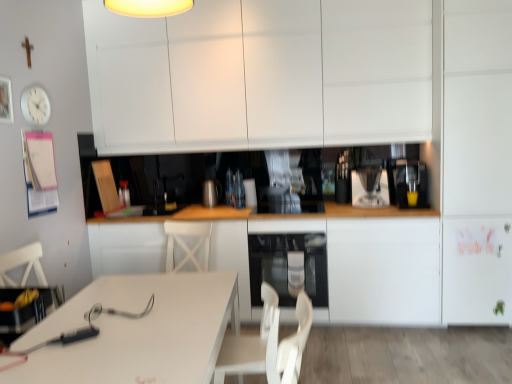
Question: Is satin black oven at lower center positioned in front of white glossy table at lower left?

Choices:
 (A) no
 (B) yes

Answer: (A)

Question: Is satin black oven at lower center to the right of white glossy table at lower left from the viewer's perspective?

Choices:
 (A) no
 (B) yes

Answer: (B)

Question: Can you confirm if satin black oven at lower center is bigger than white glossy table at lower left?

Choices:
 (A) yes
 (B) no

Answer: (B)

Question: Considering the relative sizes of satin black oven at lower center and white glossy table at lower left in the image provided, is satin black oven at lower center shorter than white glossy table at lower left?

Choices:
 (A) no
 (B) yes

Answer: (B)

Question: Is white glossy table at lower left completely or partially inside satin black oven at lower center?

Choices:
 (A) no
 (B) yes

Answer: (A)

Question: From the image's perspective, is white plastic swivel chair at lower center located above or below white matte cabinet at upper center, the 3th cabinetry in the bottom-to-top sequence?

Choices:
 (A) above
 (B) below

Answer: (B)

Question: Would you say white plastic swivel chair at lower center is to the left or to the right of white matte cabinet at upper center, the 3th cabinetry in the bottom-to-top sequence, in the picture?

Choices:
 (A) right
 (B) left

Answer: (B)

Question: In the image, is white plastic swivel chair at lower center positioned in front of or behind white matte cabinet at upper center, which is the 1th cabinetry from top to bottom?

Choices:
 (A) behind
 (B) front

Answer: (B)

Question: Is white plastic swivel chair at lower center taller or shorter than white matte cabinet at upper center, the 3th cabinetry in the bottom-to-top sequence?

Choices:
 (A) short
 (B) tall

Answer: (A)

Question: Is point (411, 190) positioned closer to the camera than point (314, 241)?

Choices:
 (A) closer
 (B) farther

Answer: (B)

Question: From a real-world perspective, relative to satin black oven at lower center, is yellow matte cup at right vertically above or below?

Choices:
 (A) above
 (B) below

Answer: (A)

Question: From the image's perspective, is yellow matte cup at right positioned above or below satin black oven at lower center?

Choices:
 (A) above
 (B) below

Answer: (A)

Question: Choose the correct answer: Is yellow matte cup at right inside satin black oven at lower center or outside it?

Choices:
 (A) inside
 (B) outside

Answer: (B)

Question: Is sleek metallic coffee maker at center, acting as the 2th appliance starting from the left, to the left or to the right of satin black oven at lower center in the image?

Choices:
 (A) right
 (B) left

Answer: (A)

Question: From the image's perspective, is sleek metallic coffee maker at center, acting as the 2th appliance starting from the left, positioned above or below satin black oven at lower center?

Choices:
 (A) below
 (B) above

Answer: (B)